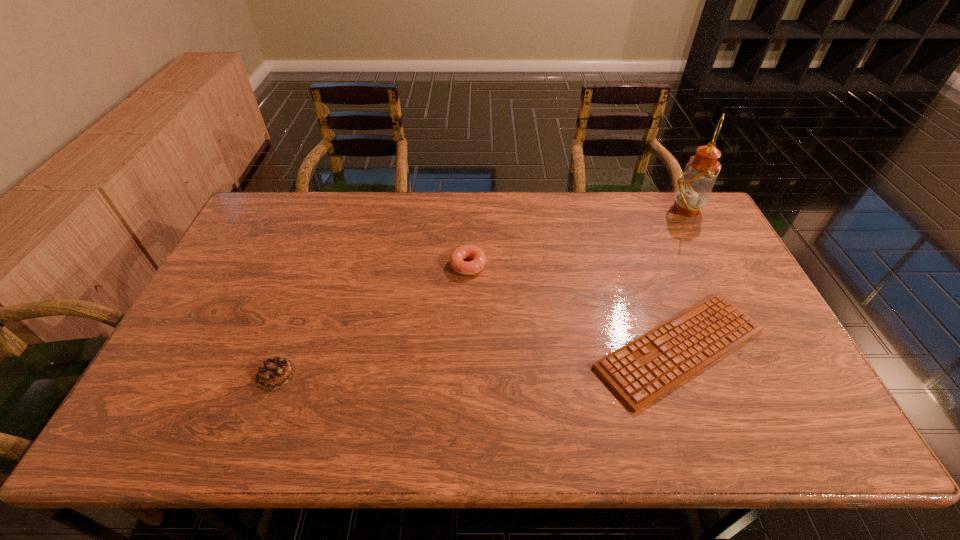
You are a GUI agent. You are given a task and a screenshot of the screen. Output one action in this format:
    pyautogui.click(x=<x>, y=<y>)
    Task: Click on the object at the far edge
    The width and height of the screenshot is (960, 540).
    Given the screenshot: What is the action you would take?
    pyautogui.click(x=694, y=187)

What are the coordinates of `object that is positioned at the near edge` in the screenshot? It's located at (646, 368).

Where is `oil lamp that is at the right edge`? The height and width of the screenshot is (540, 960). oil lamp that is at the right edge is located at coordinates (694, 187).

Where is `computer keyboard that is positioned at the right edge`? The width and height of the screenshot is (960, 540). computer keyboard that is positioned at the right edge is located at coordinates (646, 368).

Locate an element on the screen. object that is at the far right corner is located at coordinates (694, 187).

The image size is (960, 540). Identify the location of object present at the near right corner. (646, 368).

This screenshot has height=540, width=960. I want to click on vacant space at the far edge of the desktop, so click(x=374, y=198).

Image resolution: width=960 pixels, height=540 pixels. I want to click on free space at the near edge of the desktop, so click(504, 417).

The width and height of the screenshot is (960, 540). I want to click on vacant space at the left edge of the desktop, so click(x=220, y=277).

The image size is (960, 540). Identify the location of vacant space at the near left corner. (179, 418).